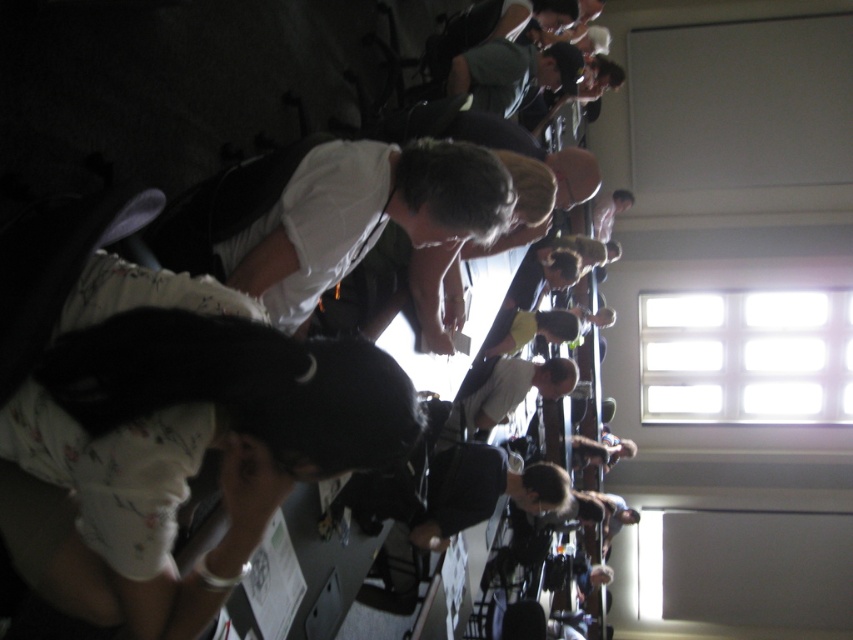
Question: Observing the image, what is the correct spatial positioning of white matte shirt at center in reference to light brown leather jacket at center?

Choices:
 (A) left
 (B) right

Answer: (A)

Question: Is white matte shirt at center further to the viewer compared to light brown leather jacket at center?

Choices:
 (A) yes
 (B) no

Answer: (B)

Question: Which object appears closest to the camera in this image?

Choices:
 (A) light brown leather jacket at center
 (B) white matte shirt at center

Answer: (B)

Question: Which point appears closest to the camera in this image?

Choices:
 (A) (505, 417)
 (B) (358, 170)

Answer: (B)

Question: Does white matte shirt at center appear under light brown leather jacket at center?

Choices:
 (A) no
 (B) yes

Answer: (A)

Question: Which point is farther to the camera?

Choices:
 (A) (494, 368)
 (B) (173, 252)

Answer: (A)